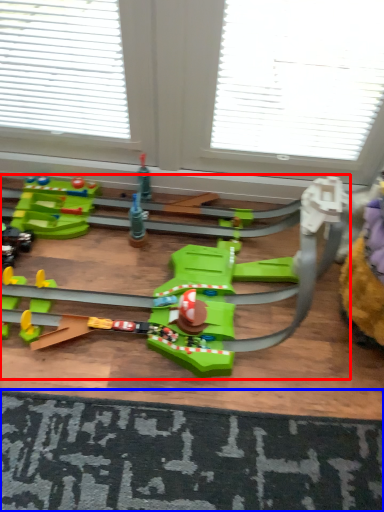
Question: Among these objects, which one is farthest to the camera, toy (highlighted by a red box) or doormat (highlighted by a blue box)?

Choices:
 (A) toy
 (B) doormat

Answer: (B)